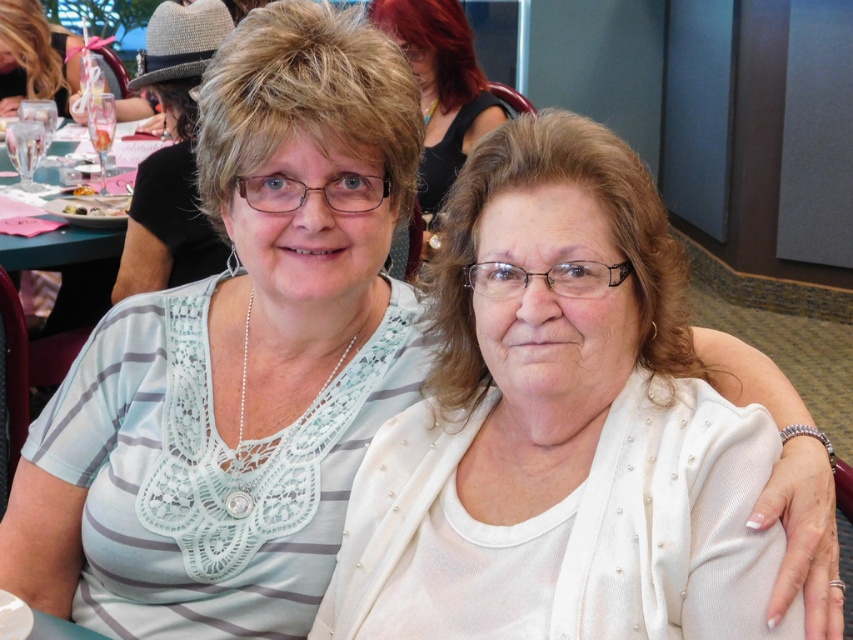
Question: Which object is positioned closest to the matte black glass at upper left?

Choices:
 (A) matte white glasses at center
 (B) white pearl cardigan at center
 (C) green plastic table at left
 (D) translucent plastic cup at upper left

Answer: (C)

Question: Which of the following is the closest to the observer?

Choices:
 (A) (50, 51)
 (B) (73, 192)
 (C) (577, 230)
 (D) (460, 33)

Answer: (C)

Question: Can you confirm if white pearl cardigan at center is thinner than translucent plastic cup at upper left?

Choices:
 (A) yes
 (B) no

Answer: (B)

Question: From the image, what is the correct spatial relationship of white pearl cardigan at center in relation to matte black glass at upper left?

Choices:
 (A) above
 (B) below

Answer: (B)

Question: Based on their relative distances, which object is farther from the matte black glass at upper left?

Choices:
 (A) matte white glasses at center
 (B) green plastic table at left

Answer: (A)

Question: Does matte black glass at upper left appear over green plastic table at left?

Choices:
 (A) no
 (B) yes

Answer: (B)